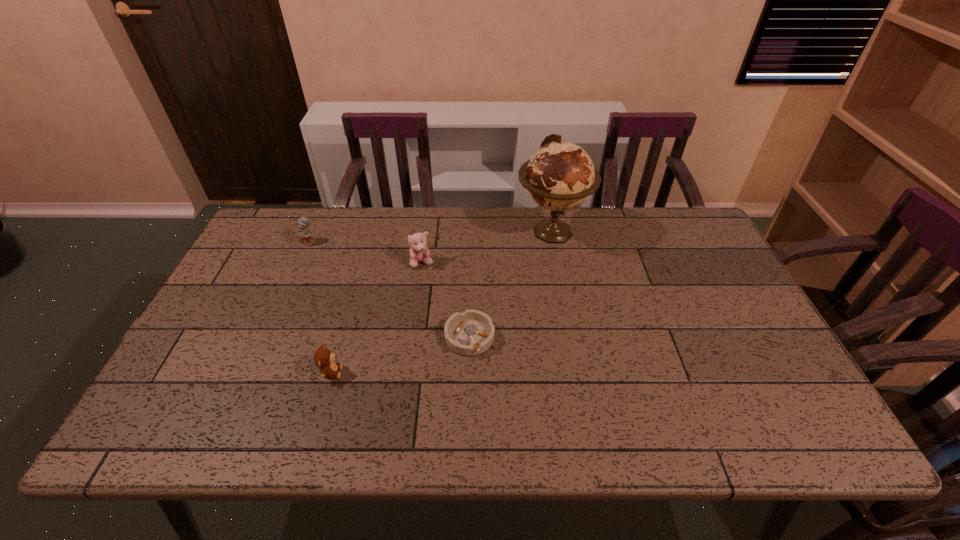
Where is `free spot between the nearest teddy bear and the globe`? free spot between the nearest teddy bear and the globe is located at coordinates (442, 302).

Locate an element on the screen. The width and height of the screenshot is (960, 540). free spot between the fourth object from left to right and the nearest teddy bear is located at coordinates (400, 355).

At what (x,y) coordinates should I click in order to perform the action: click on empty space that is in between the nearest object and the second nearest object. Please return your answer as a coordinate pair (x, y). Looking at the image, I should click on (400, 355).

This screenshot has width=960, height=540. I want to click on vacant area that lies between the rightmost object and the second teddy bear from right to left, so [x=442, y=302].

The height and width of the screenshot is (540, 960). I want to click on vacant space that's between the shortest object and the tallest object, so click(511, 285).

The image size is (960, 540). I want to click on the fourth closest object to the third object from right to left, so coord(324,359).

Identify which object is the fourth closest to the rightmost object. Please provide its 2D coordinates. Your answer should be formatted as a tuple, i.e. [(x, y)], where the tuple contains the x and y coordinates of a point satisfying the conditions above.

[(305, 235)]

Select which teddy bear is the second closest to the second farthest teddy bear. Please provide its 2D coordinates. Your answer should be formatted as a tuple, i.e. [(x, y)], where the tuple contains the x and y coordinates of a point satisfying the conditions above.

[(324, 359)]

Choose which teddy bear is the nearest neighbor to the tallest object. Please provide its 2D coordinates. Your answer should be formatted as a tuple, i.e. [(x, y)], where the tuple contains the x and y coordinates of a point satisfying the conditions above.

[(419, 252)]

At what (x,y) coordinates should I click in order to perform the action: click on vacant area that satisfies the following two spatial constraints: 1. on the front-facing side of the fourth object from left to right; 2. on the right side of the farthest teddy bear. Please return your answer as a coordinate pair (x, y). This screenshot has width=960, height=540. Looking at the image, I should click on (268, 338).